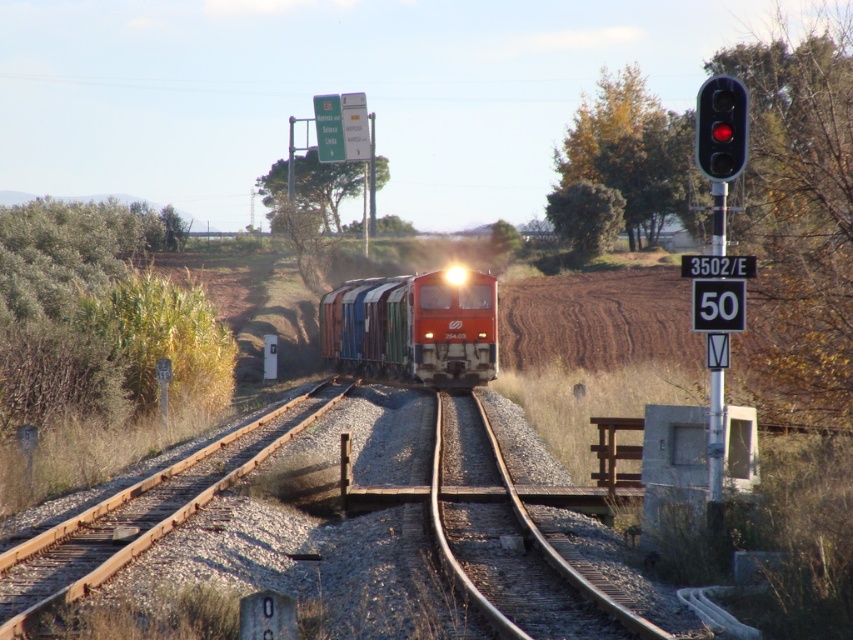
You are a train conductor observing the railway tracks ahead. There are two points marked on the tracks at coordinates point (381, 333) and point (480, 416). Which point is closer to the direction the train is heading?

Point (480, 416) is closer to the direction the train is heading because it is in front of point (381, 333).